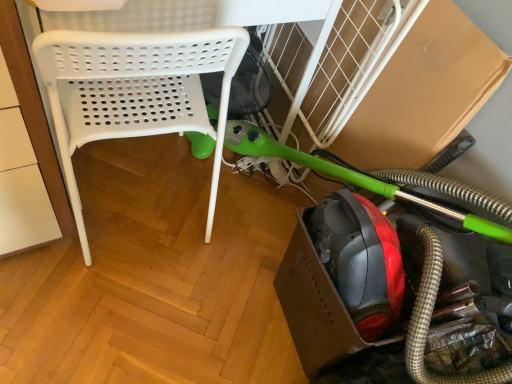
Identify the location of vacant location below white plastic chair at left (from a real-world perspective). pyautogui.click(x=151, y=220).